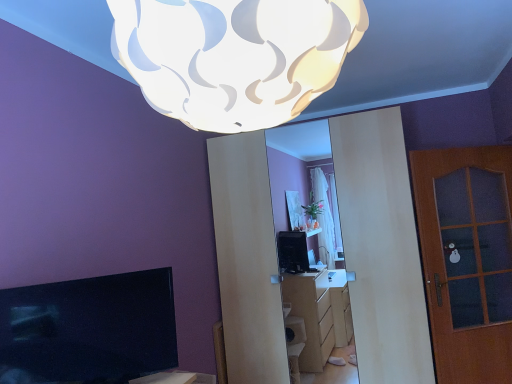
Question: Looking at their shapes, would you say white textured lampshade at upper center is wider or thinner than matte black tv at lower left?

Choices:
 (A) wide
 (B) thin

Answer: (A)

Question: From a real-world perspective, is white textured lampshade at upper center above or below matte black tv at lower left?

Choices:
 (A) below
 (B) above

Answer: (B)

Question: Considering the real-world distances, which object is closest to the white textured lampshade at upper center?

Choices:
 (A) brown wooden door at right
 (B) matte black tv at lower left

Answer: (B)

Question: Which is nearer to the white textured lampshade at upper center?

Choices:
 (A) brown wooden door at right
 (B) matte black tv at lower left

Answer: (B)